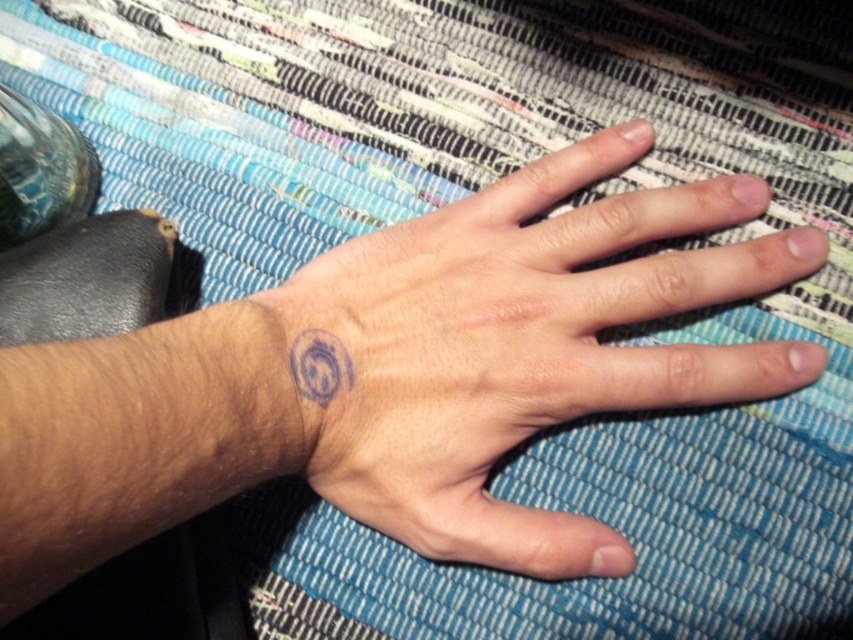
What do you see at coordinates (526, 346) in the screenshot?
I see `purple ink tattoo at center` at bounding box center [526, 346].

This screenshot has height=640, width=853. Describe the element at coordinates (526, 346) in the screenshot. I see `purple ink tattoo at center` at that location.

Identify the location of purple ink tattoo at center. (526, 346).